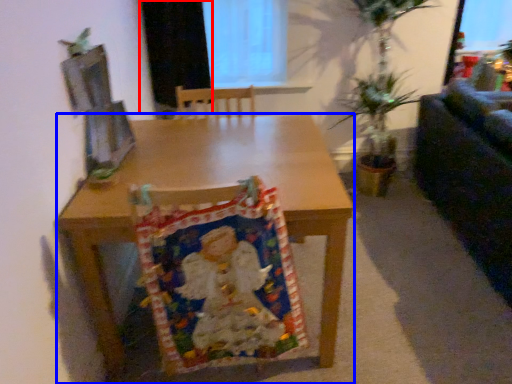
Question: Which object appears farthest to the camera in this image, curtain (highlighted by a red box) or desk (highlighted by a blue box)?

Choices:
 (A) curtain
 (B) desk

Answer: (A)